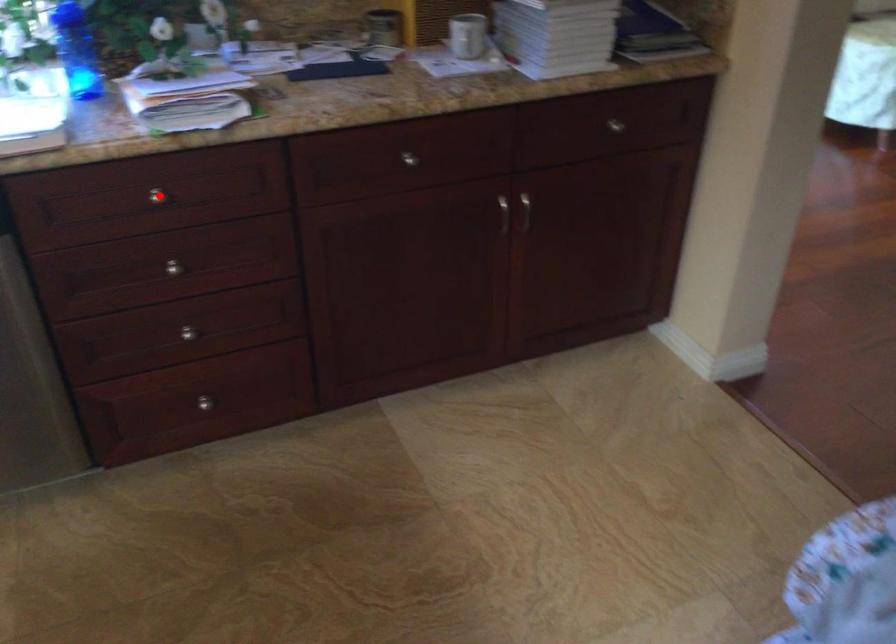
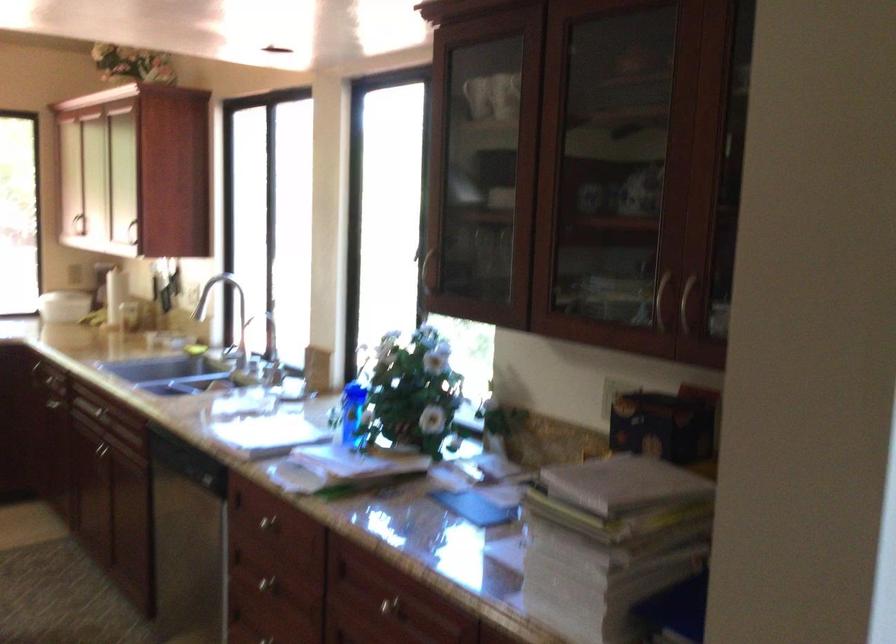
Question: I am providing you with two images of the same scene from different viewpoints. Image1 has a red point marked. In image2, the corresponding 3D location appears at what relative position? Reply with the corresponding letter.

Choices:
 (A) Closer
 (B) Farther

Answer: (B)